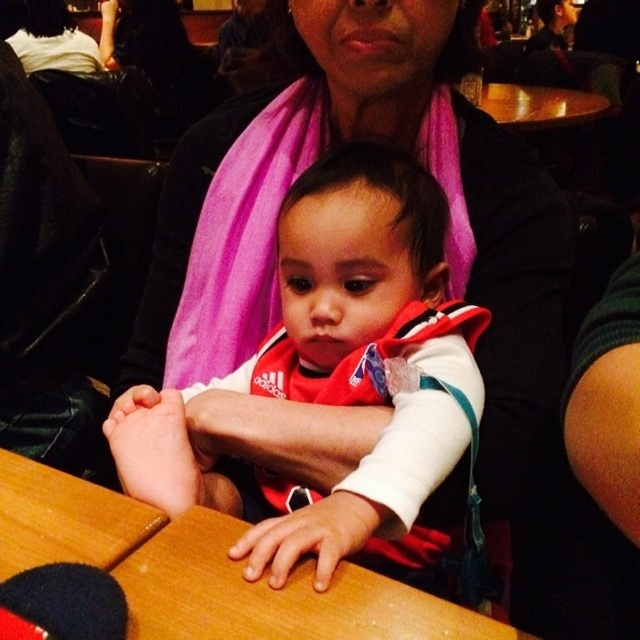
Question: Which point is closer to the camera?

Choices:
 (A) wooden table at center
 (B) white matte baby at center

Answer: (A)

Question: Does white matte baby at center come in front of wooden table at center?

Choices:
 (A) yes
 (B) no

Answer: (B)

Question: Is white matte baby at center to the left of wooden table at center from the viewer's perspective?

Choices:
 (A) no
 (B) yes

Answer: (A)

Question: Which of the following is the closest to the observer?

Choices:
 (A) (291, 563)
 (B) (424, 604)

Answer: (B)

Question: Does white matte baby at center appear under wooden table at center?

Choices:
 (A) yes
 (B) no

Answer: (B)